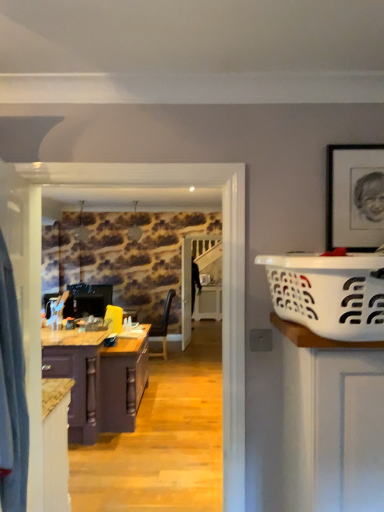
Question: From a real-world perspective, is purple wood cabinet at left below white plastic laundry basket at right?

Choices:
 (A) no
 (B) yes

Answer: (B)

Question: Can you confirm if purple wood cabinet at left is shorter than white plastic laundry basket at right?

Choices:
 (A) yes
 (B) no

Answer: (B)

Question: Does purple wood cabinet at left have a smaller size compared to white plastic laundry basket at right?

Choices:
 (A) no
 (B) yes

Answer: (A)

Question: Is purple wood cabinet at left further to the viewer compared to white plastic laundry basket at right?

Choices:
 (A) yes
 (B) no

Answer: (A)

Question: Considering the relative positions of purple wood cabinet at left and white plastic laundry basket at right in the image provided, is purple wood cabinet at left to the left of white plastic laundry basket at right from the viewer's perspective?

Choices:
 (A) no
 (B) yes

Answer: (B)

Question: Does purple wood cabinet at left lie in front of white plastic laundry basket at right?

Choices:
 (A) no
 (B) yes

Answer: (A)

Question: Is white plastic laundry basket at right aimed at purple wood cabinet at left?

Choices:
 (A) no
 (B) yes

Answer: (A)

Question: Is white plastic laundry basket at right oriented away from purple wood cabinet at left?

Choices:
 (A) yes
 (B) no

Answer: (B)

Question: Is white plastic laundry basket at right in contact with purple wood cabinet at left?

Choices:
 (A) yes
 (B) no

Answer: (B)

Question: Can you confirm if white plastic laundry basket at right is wider than purple wood cabinet at left?

Choices:
 (A) no
 (B) yes

Answer: (A)

Question: Is white plastic laundry basket at right not close to purple wood cabinet at left?

Choices:
 (A) yes
 (B) no

Answer: (A)

Question: Is white plastic laundry basket at right smaller than purple wood cabinet at left?

Choices:
 (A) yes
 (B) no

Answer: (A)

Question: Relative to purple wood cabinet at left, is white plastic laundry basket at right in front or behind?

Choices:
 (A) behind
 (B) front

Answer: (B)